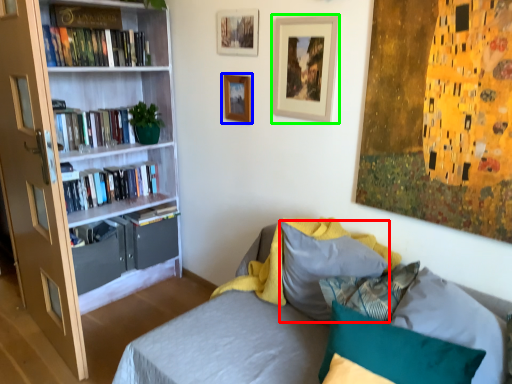
Question: Estimate the real-world distances between objects in this image. Which object is closer to pillow (highlighted by a red box), picture frame (highlighted by a blue box) or picture frame (highlighted by a green box)?

Choices:
 (A) picture frame
 (B) picture frame

Answer: (B)